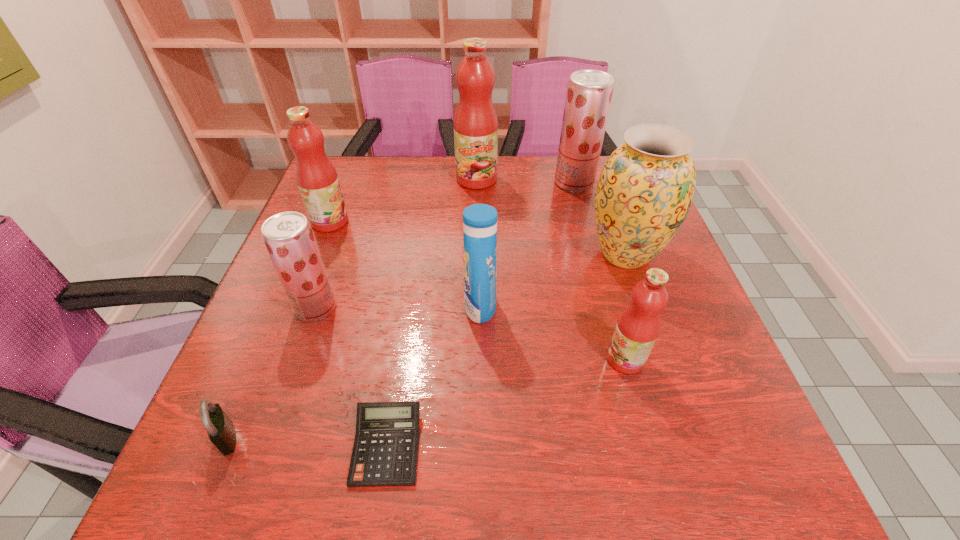
Where is `vacant space located 0.090m on the front-facing side of the detergent`? The width and height of the screenshot is (960, 540). vacant space located 0.090m on the front-facing side of the detergent is located at coordinates (422, 307).

At what (x,y) coordinates should I click in order to perform the action: click on blank space located on the front-facing side of the detergent. Please return your answer as a coordinate pair (x, y). Looking at the image, I should click on (296, 307).

Identify the location of blank space located on the front-facing side of the detergent. The height and width of the screenshot is (540, 960). (441, 307).

Locate an element on the screen. The image size is (960, 540). vacant space located on the back of the smaller strawberry fruit juice is located at coordinates (350, 209).

Where is `vacant space located 0.240m on the front label of the seventh farthest object`? Image resolution: width=960 pixels, height=540 pixels. vacant space located 0.240m on the front label of the seventh farthest object is located at coordinates point(482,359).

The image size is (960, 540). In order to click on vacant space located 0.380m on the front label of the seventh farthest object in this screenshot , I will do `click(409, 359)`.

You are a GUI agent. You are given a task and a screenshot of the screen. Output one action in this format:
    pyautogui.click(x=<x>, y=<y>)
    Task: Click on the blank space located 0.380m on the front label of the seventh farthest object
    This screenshot has width=960, height=540.
    Given the screenshot: What is the action you would take?
    pyautogui.click(x=409, y=359)

Identify the location of free space located 0.120m on the right of the eighth tallest object. This screenshot has height=540, width=960. (312, 437).

I want to click on free space located 0.290m on the back of the calculator, so click(x=411, y=289).

Locate an element on the screen. This screenshot has height=540, width=960. padlock located at the near edge is located at coordinates (221, 431).